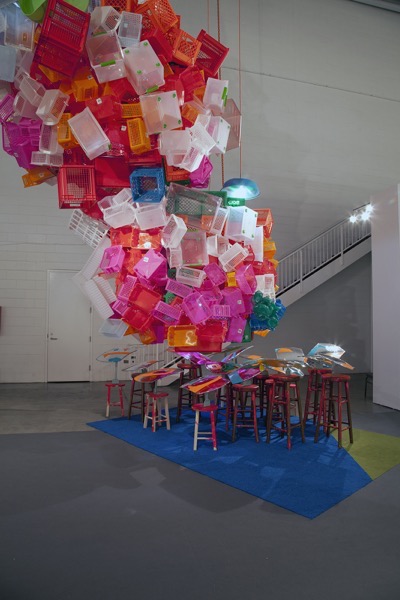
Where is `silver door handle`? silver door handle is located at coordinates (54, 338).